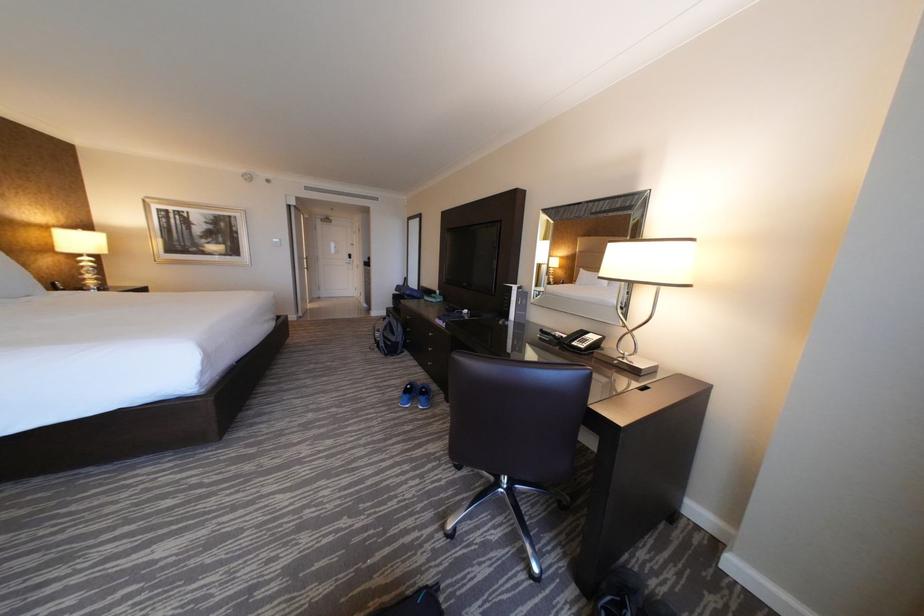
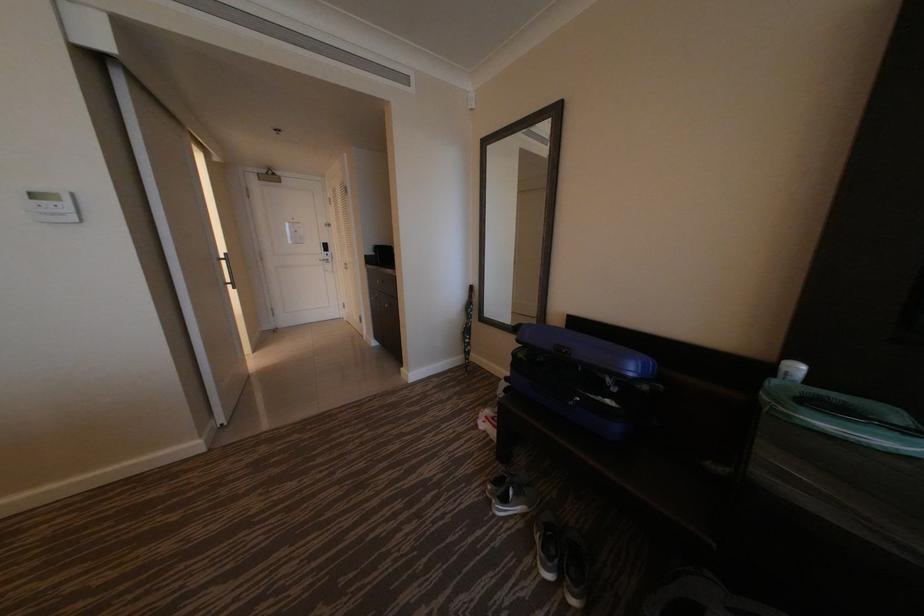
In a continuous first-person perspective shot, in which direction is the camera moving?

The movement direction of the cameraman is left, forward.